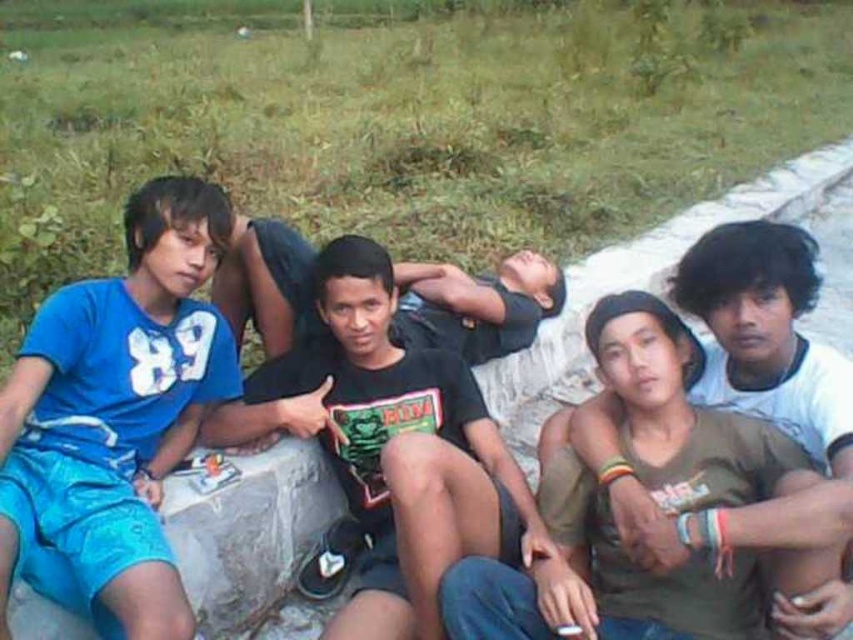
Question: Is green grass at upper center above green matte t-shirt at center?

Choices:
 (A) no
 (B) yes

Answer: (B)

Question: Which point is closer to the camera?

Choices:
 (A) (787, 52)
 (B) (170, 572)
 (C) (258, 516)

Answer: (B)

Question: Which object is farther from the camera taking this photo?

Choices:
 (A) blue fabric shorts at lower left
 (B) green grass at upper center

Answer: (B)

Question: Among these points, which one is farthest from the camera?

Choices:
 (A) (267, 256)
 (B) (141, 401)
 (C) (48, 49)
 (D) (802, 576)

Answer: (C)

Question: Is green grass at upper center positioned in front of blue fabric shorts at lower left?

Choices:
 (A) no
 (B) yes

Answer: (A)

Question: Observing the image, what is the correct spatial positioning of green matte t-shirt at center in reference to blue fabric shorts at lower left?

Choices:
 (A) above
 (B) below

Answer: (A)